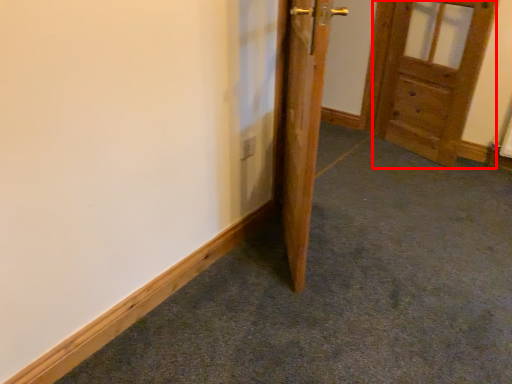
Question: Where is door (annotated by the red box) located in relation to door in the image?

Choices:
 (A) left
 (B) right

Answer: (B)